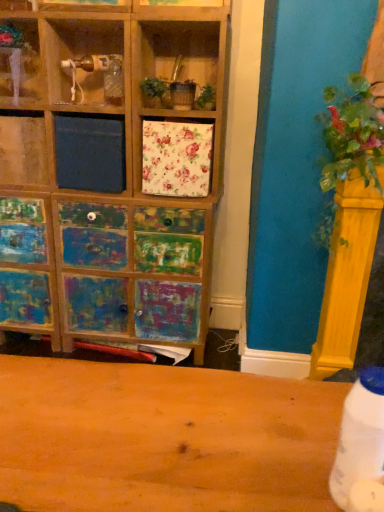
Question: Is white plastic bottle at lower right taller or shorter than green leafy plant at right?

Choices:
 (A) tall
 (B) short

Answer: (B)

Question: Would you say white plastic bottle at lower right is to the left or to the right of green leafy plant at right in the picture?

Choices:
 (A) left
 (B) right

Answer: (A)

Question: Estimate the real-world distances between objects in this image. Which object is farther from the wooden shelf at upper left?

Choices:
 (A) green leafy plant at right
 (B) white plastic bottle at lower right

Answer: (B)

Question: Estimate the real-world distances between objects in this image. Which object is farther from the white plastic bottle at lower right?

Choices:
 (A) green leafy plant at right
 (B) wooden shelf at upper left

Answer: (B)